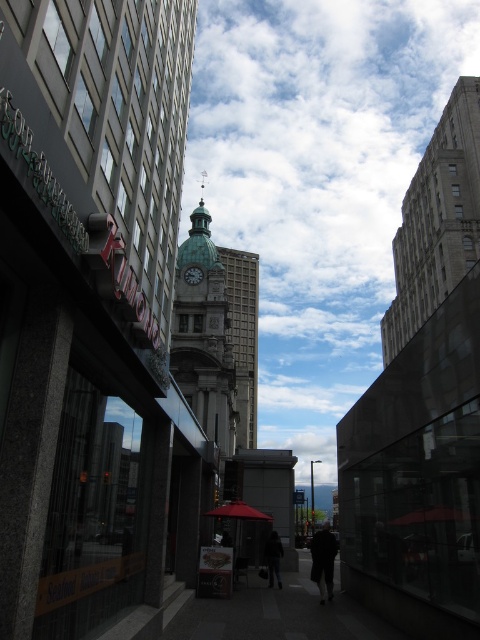
Measure the distance between point (x=170, y=372) and camera.

Point (x=170, y=372) is 277.36 feet away from camera.

Is green marble clock tower at center further to the viewer compared to silver metallic clock at center?

That is False.

Find the location of `green marble clock tower at center`. green marble clock tower at center is located at coordinates (204, 337).

Based on the photo, between gray stone building at upper right and gray concrete tower at center, which one has more height?

With more height is gray concrete tower at center.

Between point (465, 115) and point (241, 348), which one is positioned in front?

Positioned in front is point (465, 115).

This screenshot has height=640, width=480. Describe the element at coordinates (436, 220) in the screenshot. I see `gray stone building at upper right` at that location.

The height and width of the screenshot is (640, 480). I want to click on gray stone building at upper right, so click(436, 220).

Which is behind, point (216, 248) or point (222, 504)?

Positioned behind is point (216, 248).

Who is higher up, green marble clock tower at center or matte red umbrella at center?

green marble clock tower at center is higher up.

The image size is (480, 640). What do you see at coordinates (204, 337) in the screenshot?
I see `green marble clock tower at center` at bounding box center [204, 337].

At what (x,y) coordinates should I click in order to perform the action: click on green marble clock tower at center. Please return your answer as a coordinate pair (x, y). Looking at the image, I should click on (204, 337).